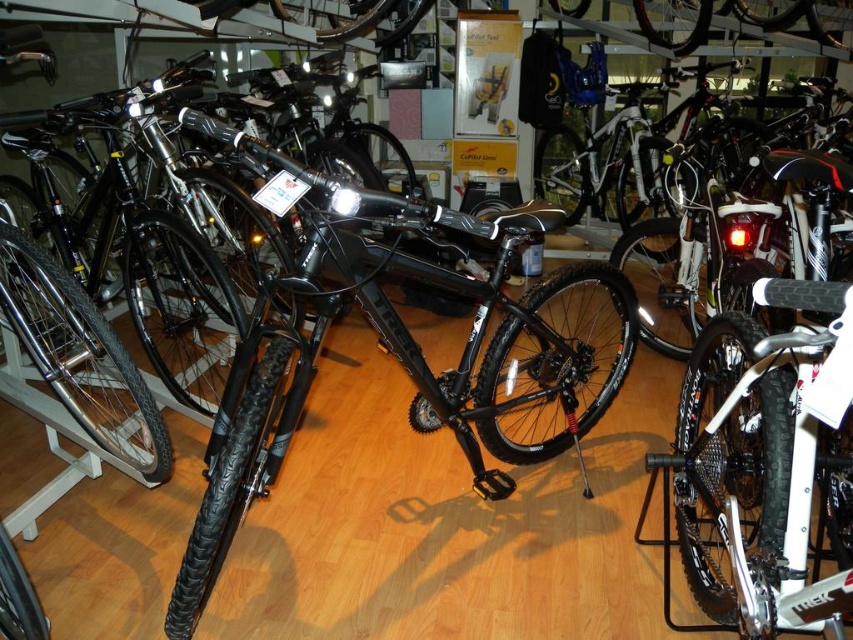
You are a customer in a bicycle shop and see two bicycles at the center of the shop. The black matte bicycle at center and the white matte bicycle at center. Which one is placed higher?

The black matte bicycle at center is above the white matte bicycle at center, so the black matte bicycle at center is placed higher.

You are standing in the center of the bicycle shop and see the black Trek mountain bike at foreground and the point marked at (408, 353). Which object is closer to you?

The black Trek mountain bike at foreground is closer to you because it is in the foreground, while the point marked at (408, 353) represents the black matte bicycle at center which is further away.

You are a customer in a bicycle shop and want to compare two bicycles. You see a black matte bicycle at center and a white matte bicycle at center. How far apart are these two bicycles?

The black matte bicycle at center and white matte bicycle at center are 61.91 centimeters apart.